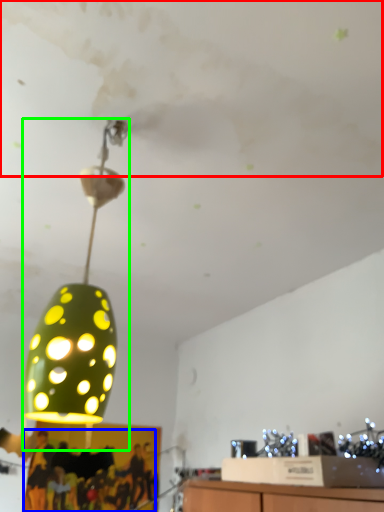
Question: Estimate the real-world distances between objects in this image. Which object is closer to cloud (highlighted by a red box), person (highlighted by a blue box) or lamp (highlighted by a green box)?

Choices:
 (A) person
 (B) lamp

Answer: (B)